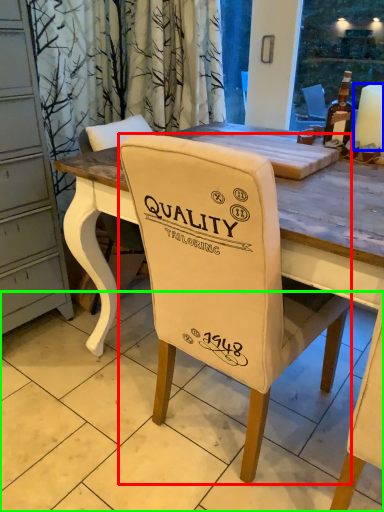
Question: Estimate the real-world distances between objects in this image. Which object is farther from chair (highlighted by a red box), candle (highlighted by a blue box) or tile (highlighted by a green box)?

Choices:
 (A) candle
 (B) tile

Answer: (A)